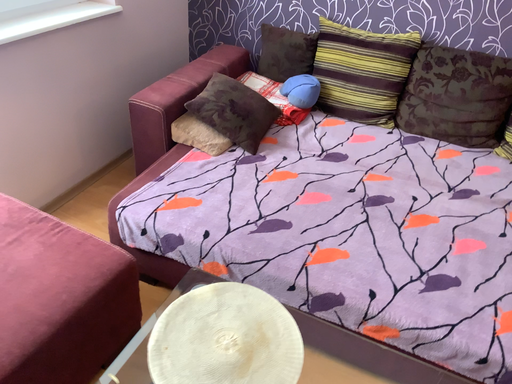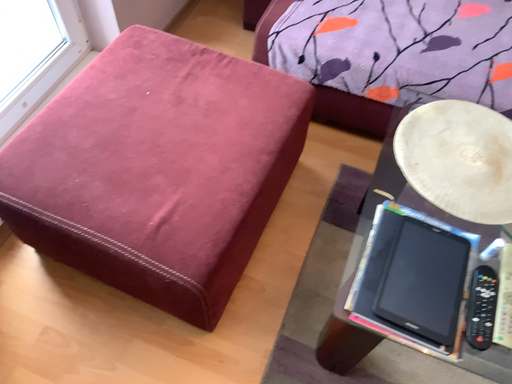
Question: How did the camera likely rotate when shooting the video?

Choices:
 (A) rotated downward
 (B) rotated upward

Answer: (A)